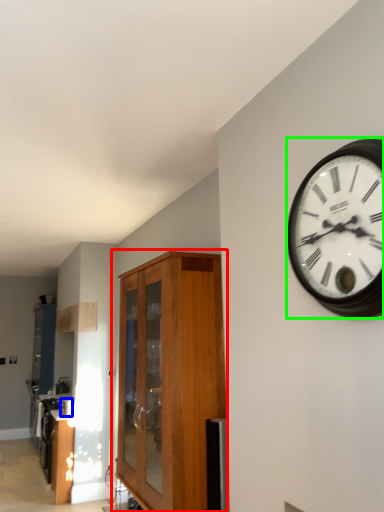
Question: Estimate the real-world distances between objects in this image. Which object is farther from cabinetry (highlighted by a red box), appliance (highlighted by a blue box) or wall clock (highlighted by a green box)?

Choices:
 (A) appliance
 (B) wall clock

Answer: (A)